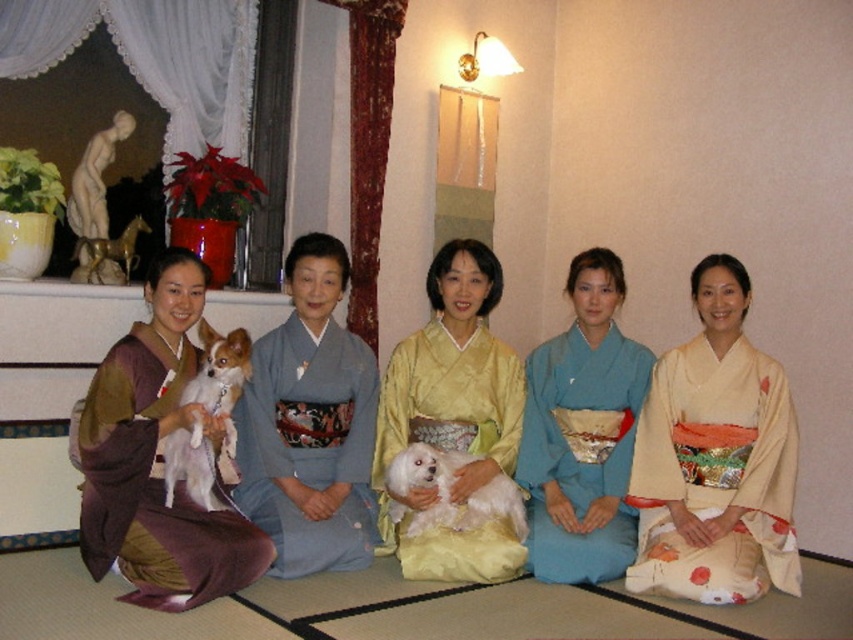
You are a tailor measuring kimonos for a fashion show. You have a display stand that can only accommodate kimonos up to 1.2 meters in width. Which kimono, the matte brown kimono at left or the blue silk kimono at center, should you choose to ensure it fits on the stand?

The blue silk kimono at center should be chosen because its width is smaller than the matte brown kimono at left, and since the stand can only hold up to 1.2 meters, the blue silk kimono at center is more likely to fit.

In the scene with the five women in kimonos and their dogs, where is the white silk kimono at center in relation to the white fluffy dog at left?

The white silk kimono at center is to the right of the white fluffy dog at left.

You are a photographer planning to take a group photo of the women in the scene. Since you want to ensure that both the silky blue kimono at center and the yellow silk kimono at center are fully visible in the frame, which kimono should you position closer to the camera to avoid overlapping with others?

The silky blue kimono at center has a smaller width than the yellow silk kimono at center. To ensure both are fully visible, position the wider yellow silk kimono at center closer to the camera so its full width can be captured without overlapping.